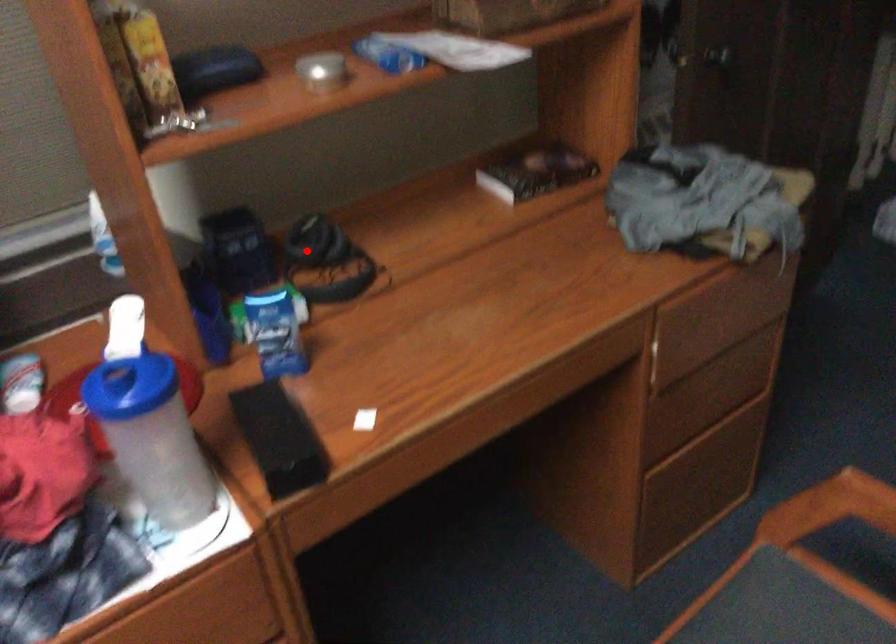
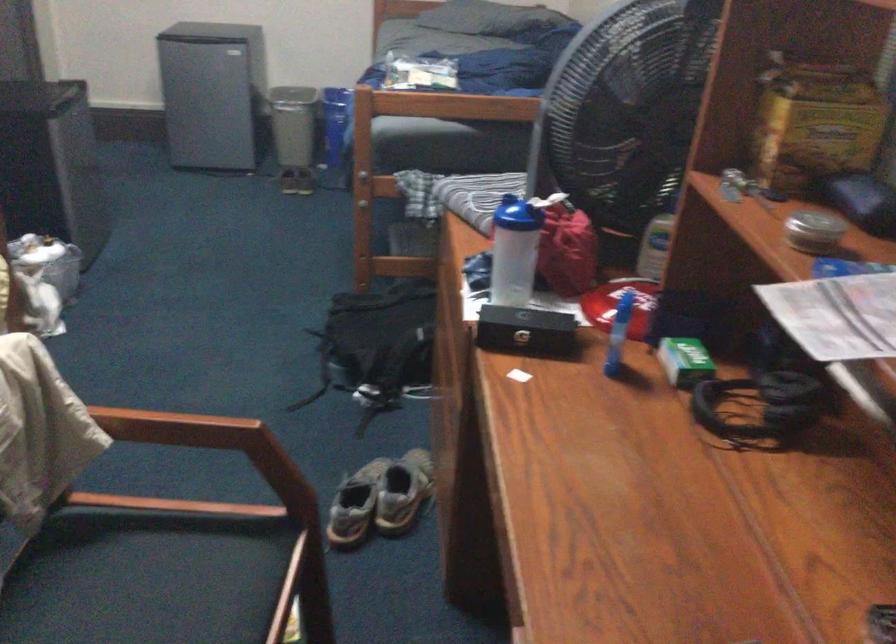
Where in the second image is the point corresponding to the highlighted location from the first image?

(767, 397)